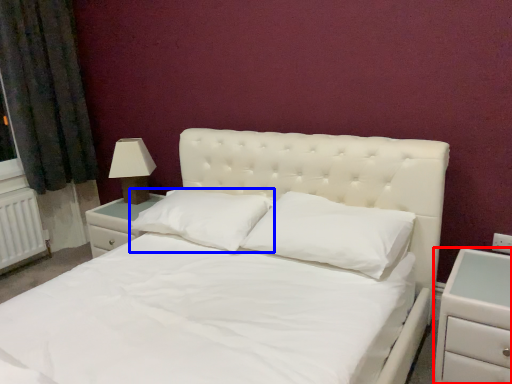
Question: Which object appears closest to the camera in this image, nightstand (highlighted by a red box) or pillow (highlighted by a blue box)?

Choices:
 (A) nightstand
 (B) pillow

Answer: (A)